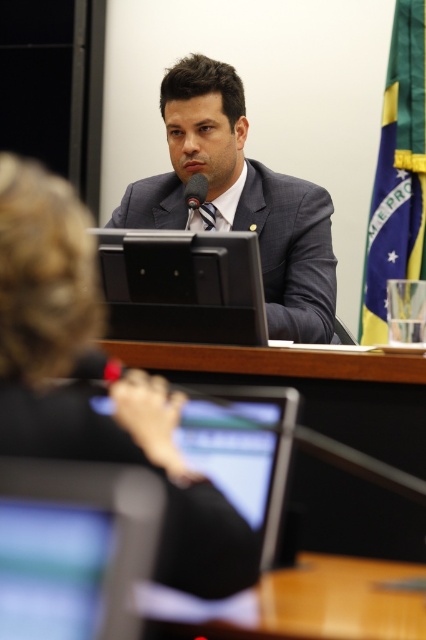
You are a photographer at a formal event. You need to capture a clear photo of the black fabric jacket at upper center and the black matte microphone at center. Which object is located to the left of the other?

The black fabric jacket at upper center is positioned on the left side of black matte microphone at center.

You are setting up equipment for a presentation. You have a matte black monitor at lower left and a wooden table at center. Which object has a smaller width?

The matte black monitor at lower left has a lesser width compared to the wooden table at center.

You are setting up equipment for a presentation. You have a matte black monitor at lower left and a black plastic laptop at center. Which device should you place in a location that requires less desk space?

The matte black monitor at lower left is smaller than the black plastic laptop at center, so it requires less desk space and should be placed in the location that needs less space.